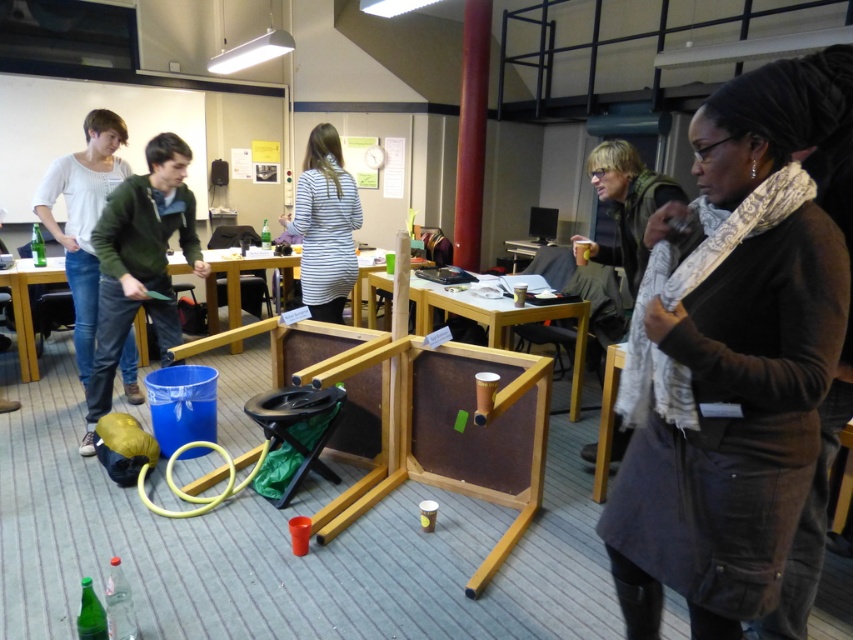
You are organizing a workshop and need to place a new item between the dark gray corduroy coat at center and the wooden table at center. Where should you position it to ensure it is between them?

Place the new item between the dark gray corduroy coat at center and the wooden table at center, positioning it to the left of the dark gray corduroy coat at center and to the right of the wooden table at center since the coat is to the right of the table.

You are a person who is 5 feet tall and standing at the brown wood table at center. You want to reach the green matte jacket at left to put it on. Can you comfortably reach it without moving from your current position?

The green matte jacket at left is 4.56 feet away from the brown wood table at center. Since you are 5 feet tall, you can comfortably reach the jacket without moving from the table.

You are a delivery person who needs to place a package between the two points marked as point (711, 628). The package is 1.5 meters long. Will it fit between them?

The distance between the two points marked as point (711, 628) is 1.47 meters, so the 1.5 meters long package will not fit between them.